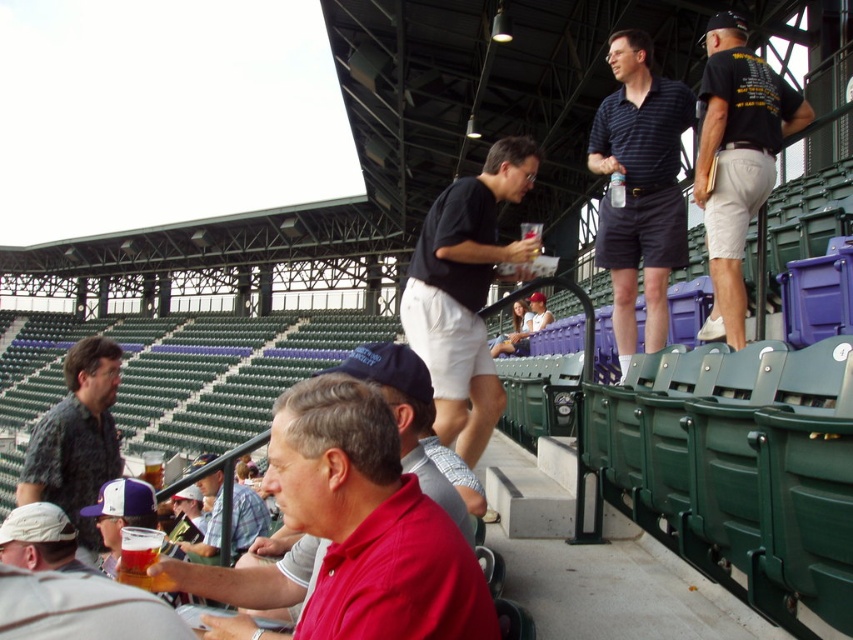
Does red cotton shirt at center have a smaller size compared to black cotton shirt at upper right?

Yes.

Which of these two, red cotton shirt at center or black cotton shirt at upper right, stands shorter?

red cotton shirt at center is shorter.

Which is behind, point (392, 557) or point (737, 294)?

The point (737, 294) is behind.

Where is `red cotton shirt at center`? The height and width of the screenshot is (640, 853). red cotton shirt at center is located at coordinates (369, 524).

Between black cotton shirt at center and dark green textured shirt at left, which one is positioned higher?

black cotton shirt at center is above.

Locate an element on the screen. Image resolution: width=853 pixels, height=640 pixels. black cotton shirt at center is located at coordinates (465, 292).

The height and width of the screenshot is (640, 853). Describe the element at coordinates (737, 157) in the screenshot. I see `black cotton shirt at upper right` at that location.

Between point (724, 276) and point (84, 557), which one is positioned in front?

Point (724, 276)

This screenshot has height=640, width=853. Identify the location of black cotton shirt at upper right. (737, 157).